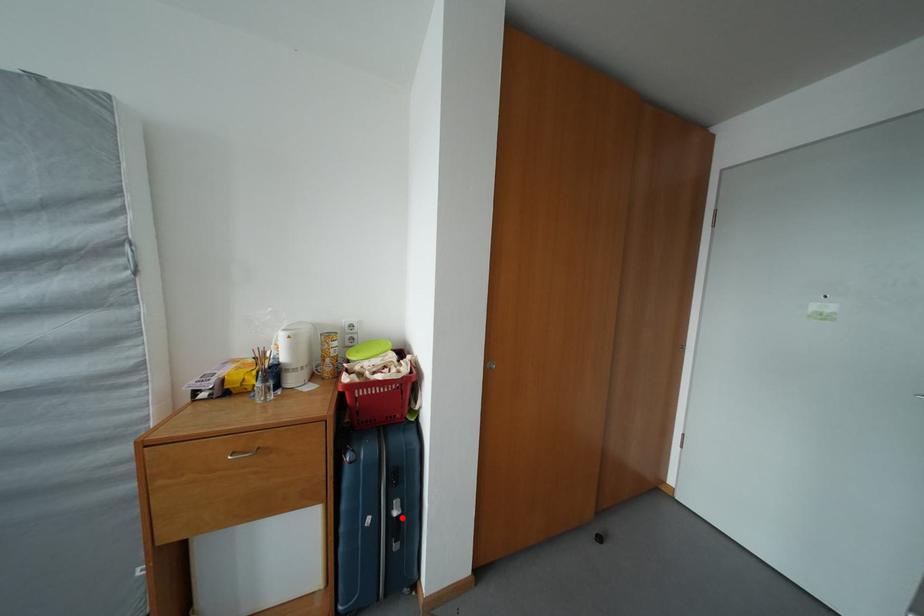
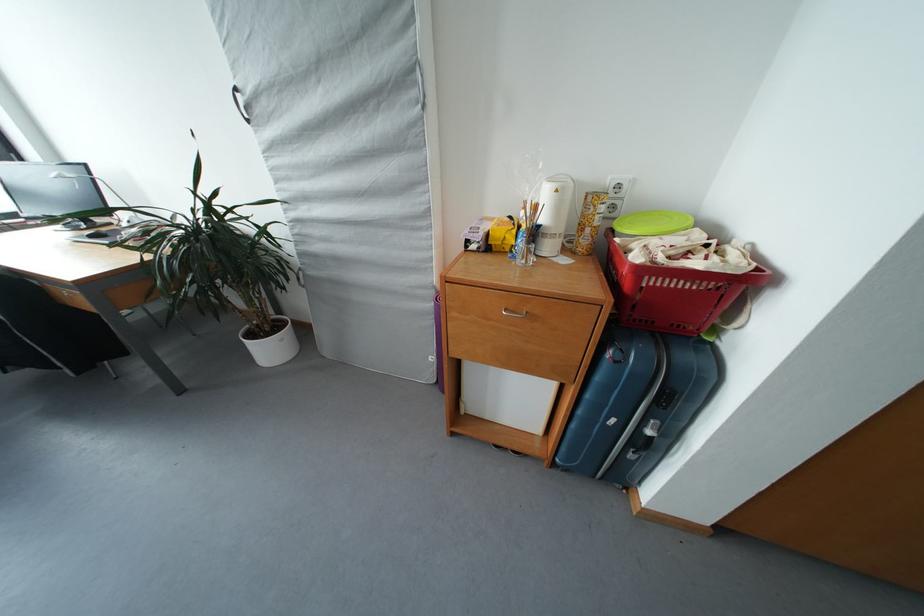
Question: I am providing you with two images of the same scene from different viewpoints. In image1, a red point is highlighted. Considering the same 3D point in image2, which of the following is correct?

Choices:
 (A) It is closer
 (B) It is farther

Answer: (A)